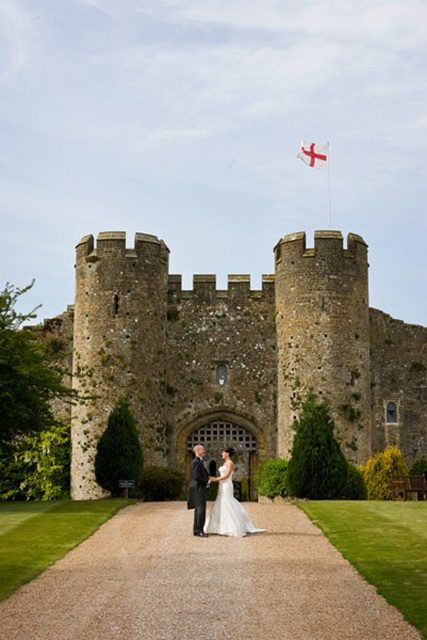
Does white satin dress at center have a lesser width compared to white fabric flag at upper center?

In fact, white satin dress at center might be wider than white fabric flag at upper center.

Does point (221, 470) lie behind point (310, 147)?

No.

Identify the location of white satin dress at center. (228, 504).

This screenshot has height=640, width=427. Find the location of `white satin dress at center`. white satin dress at center is located at coordinates (228, 504).

Between point (242, 516) and point (202, 456), which one is positioned in front?

Point (242, 516) is in front.

Is white satin dress at center taller than dark gray suit at center?

No.

Which is behind, point (228, 458) or point (193, 509)?

The point (193, 509) is more distant.

What are the coordinates of `white satin dress at center` in the screenshot? It's located at (228, 504).

The height and width of the screenshot is (640, 427). What do you see at coordinates (198, 490) in the screenshot?
I see `dark gray suit at center` at bounding box center [198, 490].

Is dark gray suit at center closer to the viewer compared to white fabric flag at upper center?

Yes, dark gray suit at center is in front of white fabric flag at upper center.

Based on the photo, who is more forward, (198, 493) or (324, 161)?

Point (198, 493) is in front.

Identify the location of dark gray suit at center. (198, 490).